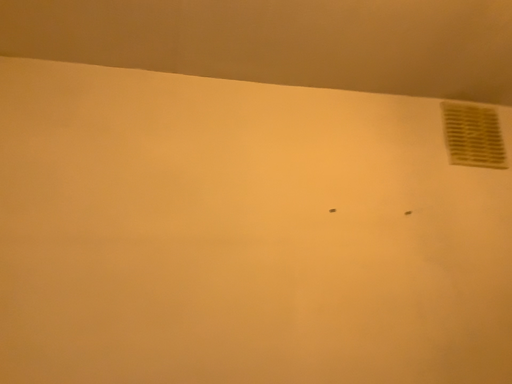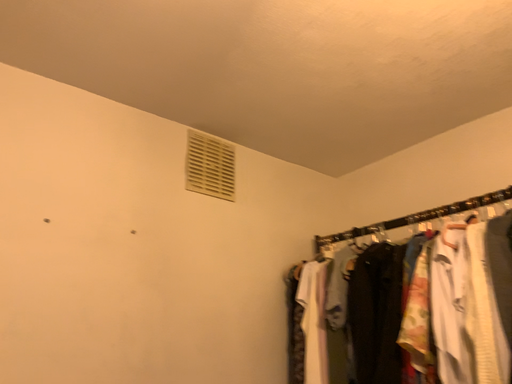
Question: How did the camera likely rotate when shooting the video?

Choices:
 (A) rotated right
 (B) rotated left

Answer: (A)